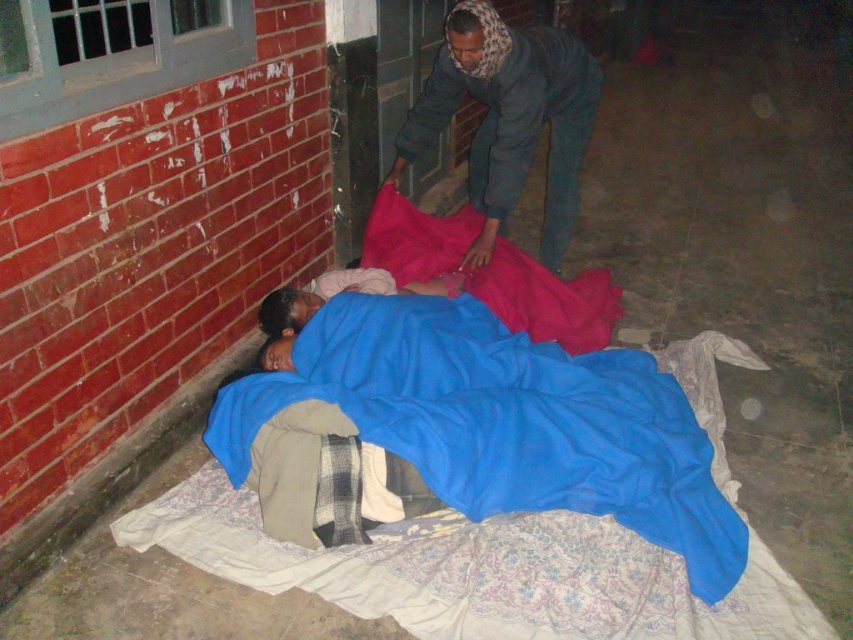
Who is shorter, dark gray fabric at upper center or matte pink fabric at center?

matte pink fabric at center is shorter.

Between point (442, 108) and point (421, 218), which one is positioned behind?

Point (442, 108)

Image resolution: width=853 pixels, height=640 pixels. I want to click on dark gray fabric at upper center, so click(508, 116).

Where is `dark gray fabric at upper center`? This screenshot has height=640, width=853. dark gray fabric at upper center is located at coordinates (508, 116).

Does point (335, 333) come behind point (502, 212)?

No, it is not.

Does blue fabric at lower left appear under dark gray fabric at upper center?

Yes.

Where is `blue fabric at lower left`? blue fabric at lower left is located at coordinates (537, 419).

Who is more distant from viewer, [474,477] or [405,227]?

Point [405,227]

Is blue fabric at lower left to the left of matte pink fabric at center from the viewer's perspective?

Indeed, blue fabric at lower left is positioned on the left side of matte pink fabric at center.

Measure the distance between blue fabric at lower left and camera.

blue fabric at lower left is 6.70 feet from camera.

I want to click on blue fabric at lower left, so click(x=537, y=419).